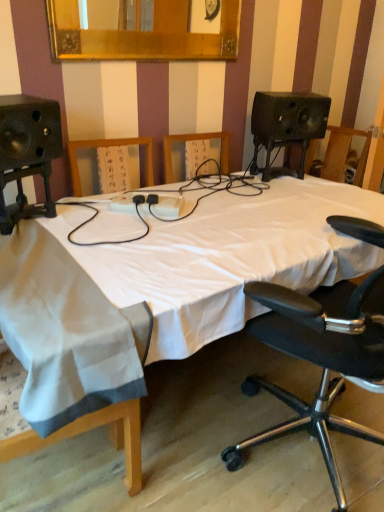
Question: Is gold-framed mirror at upper center closer to the viewer compared to white fabric bed at center?

Choices:
 (A) yes
 (B) no

Answer: (B)

Question: Is gold-framed mirror at upper center in contact with white fabric bed at center?

Choices:
 (A) yes
 (B) no

Answer: (B)

Question: Is gold-framed mirror at upper center positioned beyond the bounds of white fabric bed at center?

Choices:
 (A) no
 (B) yes

Answer: (B)

Question: Is gold-framed mirror at upper center facing towards white fabric bed at center?

Choices:
 (A) no
 (B) yes

Answer: (A)

Question: Is gold-framed mirror at upper center surrounding white fabric bed at center?

Choices:
 (A) no
 (B) yes

Answer: (A)

Question: Is gold-framed mirror at upper center positioned far away from white fabric bed at center?

Choices:
 (A) yes
 (B) no

Answer: (B)

Question: Is white cloth at left shorter than gold-framed mirror at upper center?

Choices:
 (A) yes
 (B) no

Answer: (B)

Question: Is white cloth at left smaller than gold-framed mirror at upper center?

Choices:
 (A) yes
 (B) no

Answer: (B)

Question: From the image's perspective, is white cloth at left on gold-framed mirror at upper center?

Choices:
 (A) yes
 (B) no

Answer: (B)

Question: From a real-world perspective, is white cloth at left positioned over gold-framed mirror at upper center based on gravity?

Choices:
 (A) yes
 (B) no

Answer: (B)

Question: Does white cloth at left have a greater width compared to gold-framed mirror at upper center?

Choices:
 (A) no
 (B) yes

Answer: (B)

Question: Is white cloth at left at the right side of gold-framed mirror at upper center?

Choices:
 (A) no
 (B) yes

Answer: (A)

Question: From a real-world perspective, is black leather office chair at right on white cloth at left?

Choices:
 (A) no
 (B) yes

Answer: (B)